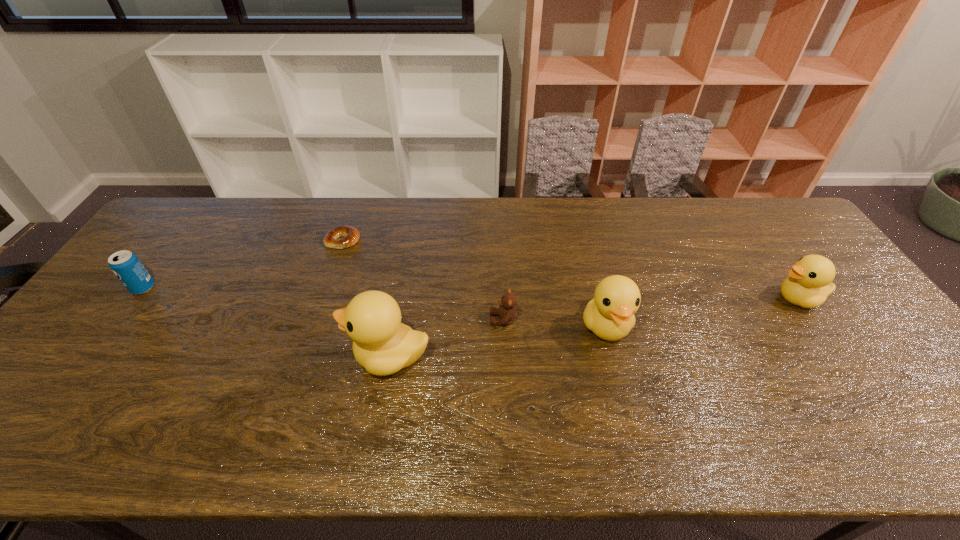
Locate an element on the screen. vacant space at the right edge is located at coordinates (800, 248).

Where is `vacant space at the far left corner of the desktop`? The width and height of the screenshot is (960, 540). vacant space at the far left corner of the desktop is located at coordinates (173, 231).

Identify the location of blank area at the far right corner. The height and width of the screenshot is (540, 960). (770, 207).

This screenshot has width=960, height=540. In order to click on free area in between the fourth shortest object and the third shortest object in this screenshot , I will do `click(470, 293)`.

Locate an element on the screen. This screenshot has width=960, height=540. free space between the second tallest duck and the shortest duck is located at coordinates (702, 312).

Locate an element on the screen. This screenshot has width=960, height=540. vacant area between the second shortest object and the second duck from left to right is located at coordinates (555, 322).

Identify the location of vacant point located between the second duck from left to right and the third tallest object. (702, 312).

Identify the location of vacant space that is in between the fourth object from left to right and the leftmost duck. (446, 338).

In order to click on vacant area that lies between the soda can and the fourth object from right to left in this screenshot , I will do `click(266, 322)`.

Image resolution: width=960 pixels, height=540 pixels. I want to click on object that is the second nearest to the third object from left to right, so click(340, 237).